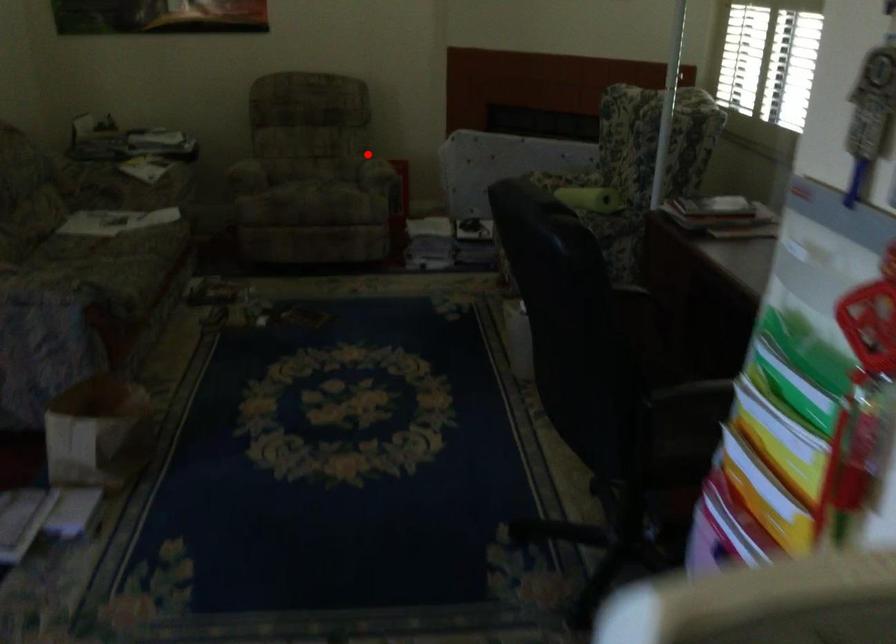
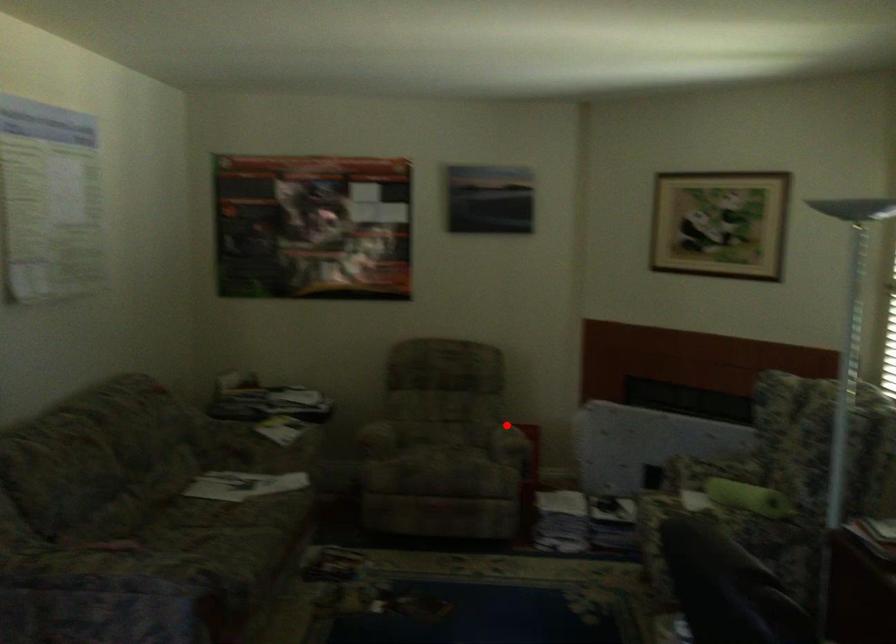
I am providing you with two images of the same scene from different viewpoints. A red point is marked on the first image and another point is marked on the second image. Is the red point in image1 aligned with the point shown in image2?

Yes